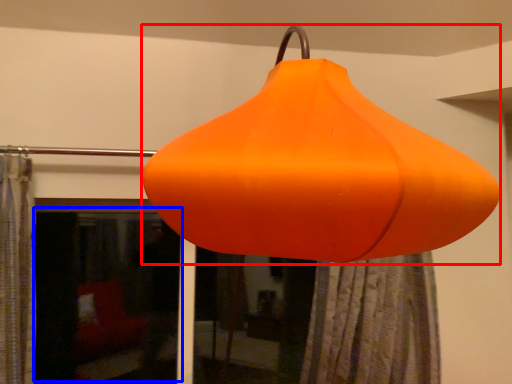
Question: Which point is further to the camera, lantern (highlighted by a red box) or window screen (highlighted by a blue box)?

Choices:
 (A) lantern
 (B) window screen

Answer: (B)